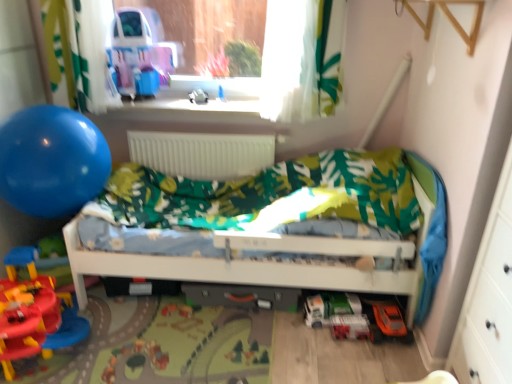
This screenshot has width=512, height=384. In order to click on free point above white matte radiator at center (from a real-world perspective) in this screenshot , I will do `click(203, 127)`.